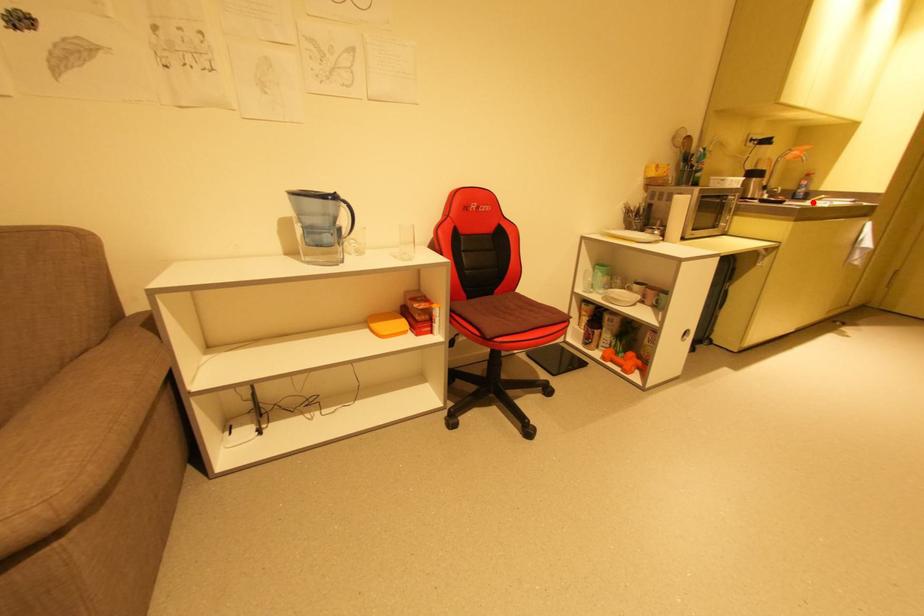
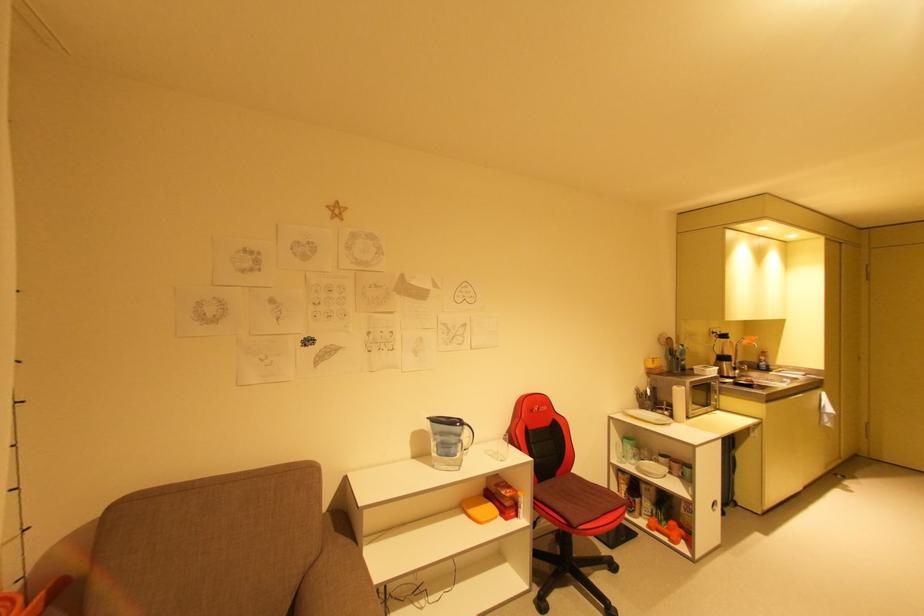
The point at the highlighted location is marked in the first image. Where is the corresponding point in the second image?

(776, 373)